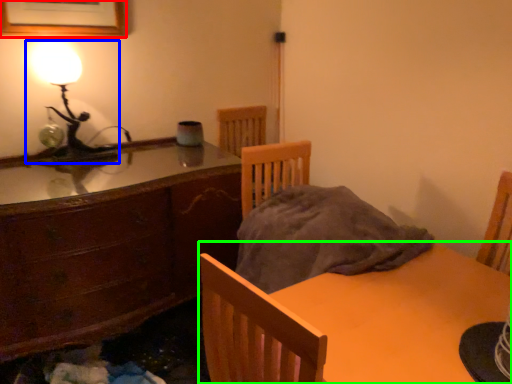
Question: Estimate the real-world distances between objects in this image. Which object is farther from picture frame (highlighted by a red box), lamp (highlighted by a blue box) or table (highlighted by a green box)?

Choices:
 (A) lamp
 (B) table

Answer: (B)